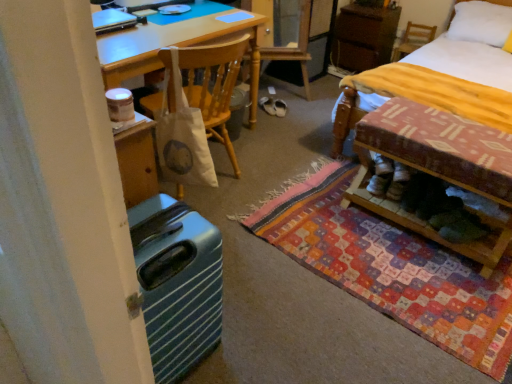
Question: Is yellow fabric bed at lower right bigger or smaller than multicolored woven mat at lower right?

Choices:
 (A) small
 (B) big

Answer: (B)

Question: From a real-world perspective, is yellow fabric bed at lower right physically located above or below multicolored woven mat at lower right?

Choices:
 (A) below
 (B) above

Answer: (B)

Question: Which of these objects is positioned closest to the wooden chair at upper right, the 1th chair viewed from the right?

Choices:
 (A) white fabric shoe at center, marked as the 2th footwear in a right-to-left arrangement
 (B) yellow fabric bed at lower right
 (C) white soft pillow at upper right
 (D) brown wood cabinet at upper right
 (E) white fabric shoe at center, the 2th footwear viewed from the left

Answer: (D)

Question: Estimate the real-world distances between objects in this image. Which object is closer to the white soft pillow at upper right?

Choices:
 (A) wooden bed frame at lower right
 (B) white fabric shoe at center, the first footwear viewed from the right
 (C) wooden chair at upper right, positioned as the second chair in front-to-back order
 (D) white fabric shoe at center, marked as the 2th footwear in a right-to-left arrangement
 (E) multicolored woven mat at lower right

Answer: (C)